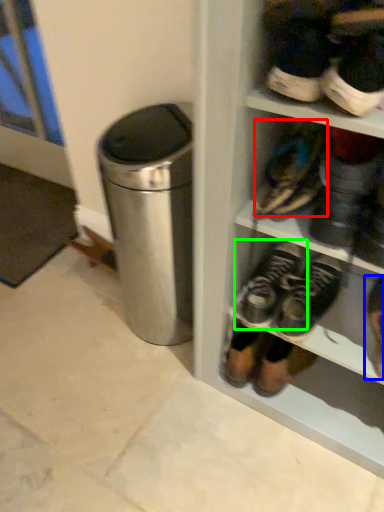
Question: Which is farther away from footwear (highlighted by a red box)? footwear (highlighted by a blue box) or footwear (highlighted by a green box)?

Choices:
 (A) footwear
 (B) footwear

Answer: (A)